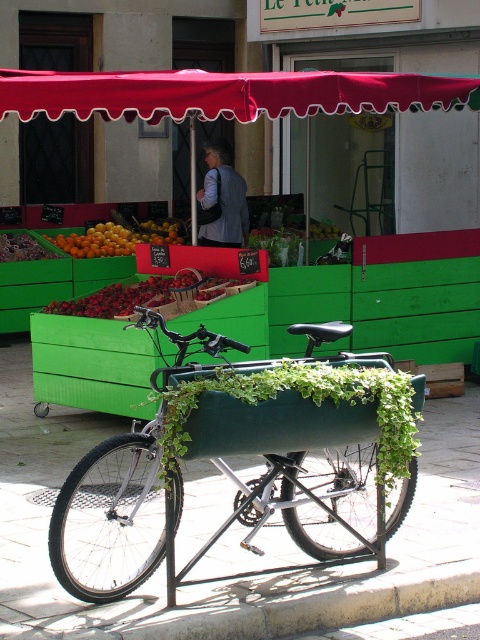
You are standing in front of the fruit stall and want to take a photo of the two points mentioned. Which point, point (331, 486) or point (377, 74), will appear larger in your camera view?

Point (331, 486) will appear larger in the camera view because it is closer to the camera than point (377, 74).

You are a customer standing at the entrance of the fruit stall. You want to reach the shiny red strawberries at center without walking under the red fabric canopy at upper center. Is it possible to do so while staying within the paved area?

The red fabric canopy at upper center and shiny red strawberries at center are 2.21 meters apart from each other. Since the strawberries are at center and the canopy is at upper center, you can walk around the sides of the canopy while staying on the paved area to reach the strawberries without going under the canopy.